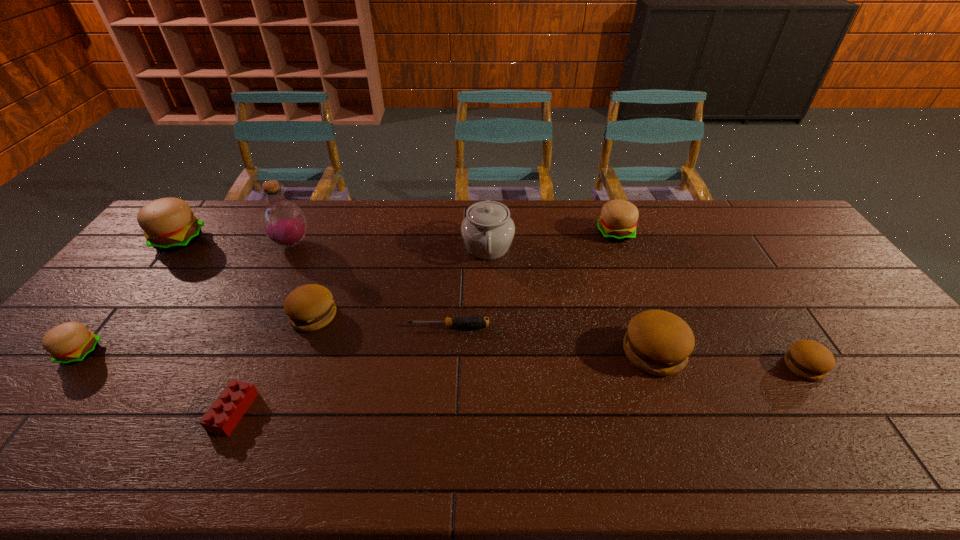
Image resolution: width=960 pixels, height=540 pixels. In order to click on free spot that satisfies the following two spatial constraints: 1. on the front side of the rightmost hamburger; 2. on the right side of the second biggest brown hamburger in this screenshot , I will do `click(296, 366)`.

Find the location of a particular element. free space that satisfies the following two spatial constraints: 1. on the back side of the second smallest beige hamburger; 2. on the left side of the second biggest brown hamburger is located at coordinates (345, 233).